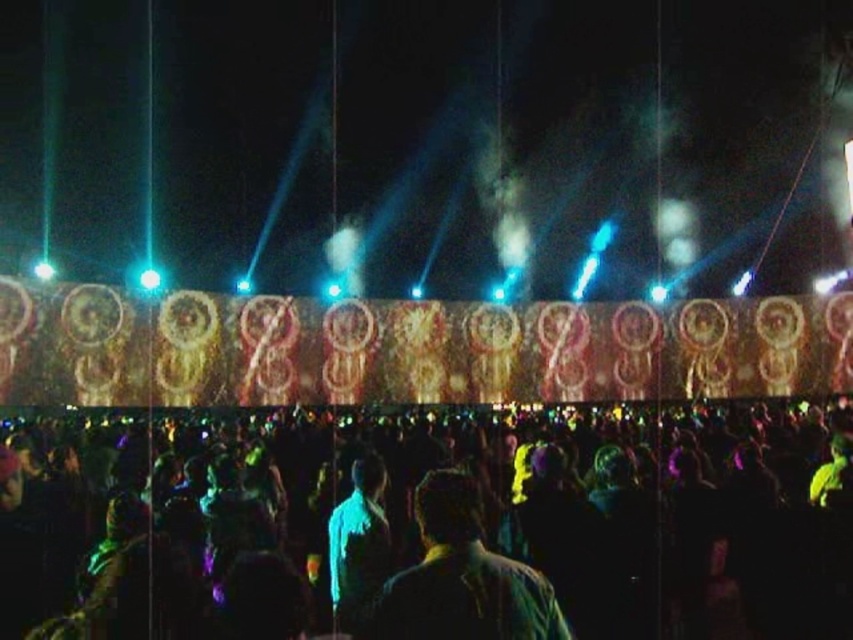
You are standing at the back of the crowd at the event. You notice two points of light in the sky above you, labeled as point (416, 636) and point (335, 595). Which point is closer to you?

Point (416, 636) is in front of point (335, 595), so it is closer to you.

You are an event planner trying to set up a new light beam in the area between the black fabric crowd at lower center and the blue fabric at center. Based on their positions, which fabric will the light beam hit first?

The black fabric crowd at lower center is positioned over the blue fabric at center, so the light beam will hit the black fabric crowd at lower center first before reaching the blue fabric at center.